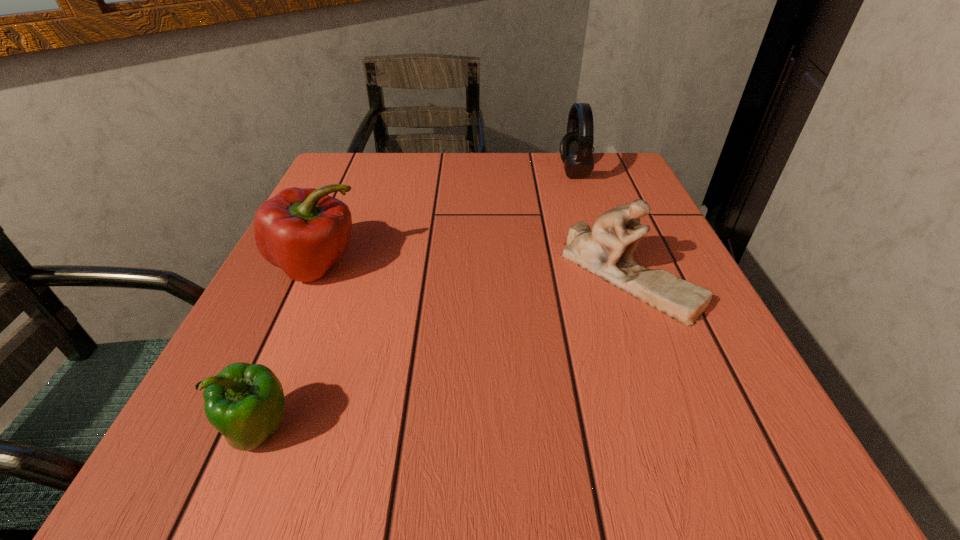
The image size is (960, 540). In order to click on headset in this screenshot , I will do (576, 146).

Find the location of `the farther bell pepper`. the farther bell pepper is located at coordinates (304, 231).

This screenshot has height=540, width=960. Find the location of `figurine`. figurine is located at coordinates (606, 251).

Where is `the nearer bell pepper`? The image size is (960, 540). the nearer bell pepper is located at coordinates (245, 403).

The width and height of the screenshot is (960, 540). Identify the location of the shorter bell pepper. (245, 403).

This screenshot has height=540, width=960. Find the location of `free space located on the earcups of the farthest object`. free space located on the earcups of the farthest object is located at coordinates (464, 172).

Identify the location of free spot located 0.270m on the earcups of the farthest object. This screenshot has width=960, height=540. (451, 172).

Locate an element on the screen. The width and height of the screenshot is (960, 540). vacant space located on the earcups of the farthest object is located at coordinates (537, 172).

You are a GUI agent. You are given a task and a screenshot of the screen. Output one action in this format:
    pyautogui.click(x=<x>, y=<y>)
    Task: Click on the vacant space located on the back of the farther bell pepper
    
    Given the screenshot: What is the action you would take?
    [341, 212]

This screenshot has width=960, height=540. What are the coordinates of `vacant space located on the front-facing side of the figurine` in the screenshot? It's located at (703, 468).